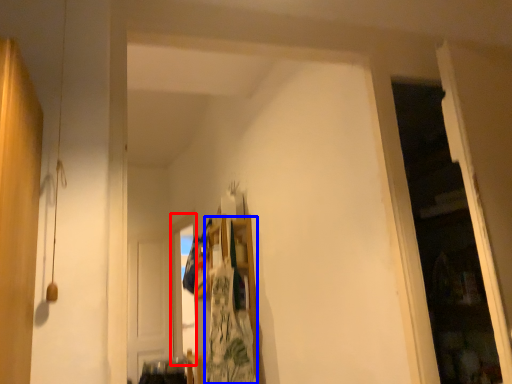
Question: Which point is closer to the camera, window (highlighted by a red box) or laundry (highlighted by a blue box)?

Choices:
 (A) window
 (B) laundry

Answer: (B)